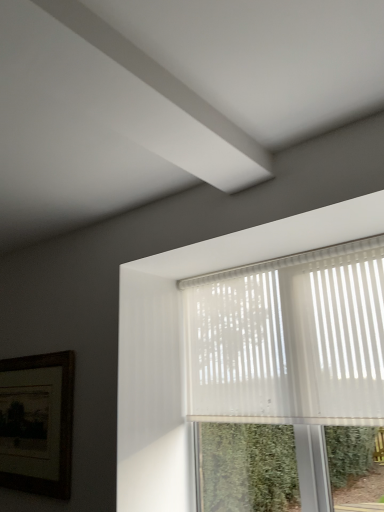
Question: Is wooden framed picture at lower left outside of translucent plastic window at upper right?

Choices:
 (A) no
 (B) yes

Answer: (B)

Question: From the image's perspective, would you say wooden framed picture at lower left is positioned over translucent plastic window at upper right?

Choices:
 (A) yes
 (B) no

Answer: (B)

Question: Is wooden framed picture at lower left aimed at translucent plastic window at upper right?

Choices:
 (A) yes
 (B) no

Answer: (B)

Question: Does wooden framed picture at lower left have a lesser height compared to translucent plastic window at upper right?

Choices:
 (A) no
 (B) yes

Answer: (B)

Question: Considering the relative sizes of wooden framed picture at lower left and translucent plastic window at upper right in the image provided, is wooden framed picture at lower left smaller than translucent plastic window at upper right?

Choices:
 (A) no
 (B) yes

Answer: (B)

Question: From a real-world perspective, is wooden framed picture at lower left positioned under translucent plastic window at upper right based on gravity?

Choices:
 (A) no
 (B) yes

Answer: (B)

Question: Does translucent plastic window at upper right have a greater height compared to wooden framed picture at lower left?

Choices:
 (A) no
 (B) yes

Answer: (B)

Question: Can you confirm if translucent plastic window at upper right is positioned to the right of wooden framed picture at lower left?

Choices:
 (A) no
 (B) yes

Answer: (B)

Question: Is translucent plastic window at upper right further to the viewer compared to wooden framed picture at lower left?

Choices:
 (A) no
 (B) yes

Answer: (A)

Question: Does translucent plastic window at upper right have a greater width compared to wooden framed picture at lower left?

Choices:
 (A) yes
 (B) no

Answer: (A)

Question: Considering the relative positions of translucent plastic window at upper right and wooden framed picture at lower left in the image provided, is translucent plastic window at upper right to the left of wooden framed picture at lower left from the viewer's perspective?

Choices:
 (A) no
 (B) yes

Answer: (A)

Question: Does translucent plastic window at upper right have a smaller size compared to wooden framed picture at lower left?

Choices:
 (A) no
 (B) yes

Answer: (A)

Question: Considering their positions, is translucent plastic window at upper right located in front of or behind wooden framed picture at lower left?

Choices:
 (A) behind
 (B) front

Answer: (B)